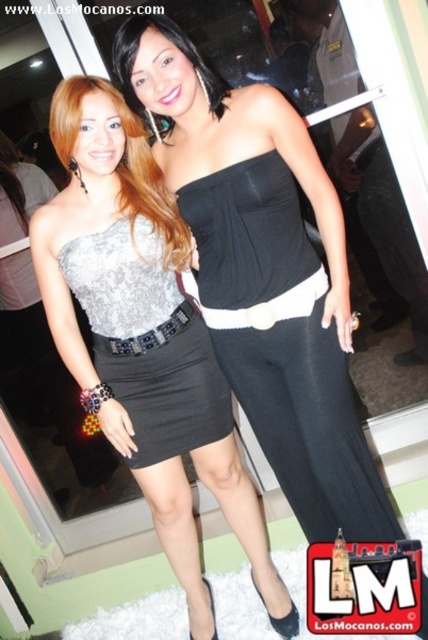
Question: Among these objects, which one is farthest from the camera?

Choices:
 (A) silver sequined dress at left
 (B) silver sequined dress at center
 (C) black satin strapless dress at center
 (D) black leather belt at center

Answer: (D)

Question: Considering the relative positions of silver sequined dress at center and matte black dress at center in the image provided, where is silver sequined dress at center located with respect to matte black dress at center?

Choices:
 (A) right
 (B) left

Answer: (B)

Question: Which point is farther from the camera taking this photo?

Choices:
 (A) (193, 212)
 (B) (201, 321)

Answer: (B)

Question: Can you confirm if silver sequined dress at left is bigger than matte black dress at center?

Choices:
 (A) yes
 (B) no

Answer: (A)

Question: Can you confirm if black satin strapless dress at center is positioned above matte black dress at center?

Choices:
 (A) yes
 (B) no

Answer: (B)

Question: Which of the following is the farthest from the observer?

Choices:
 (A) (199, 74)
 (B) (401, 536)
 (C) (145, 304)
 (D) (175, 472)

Answer: (D)